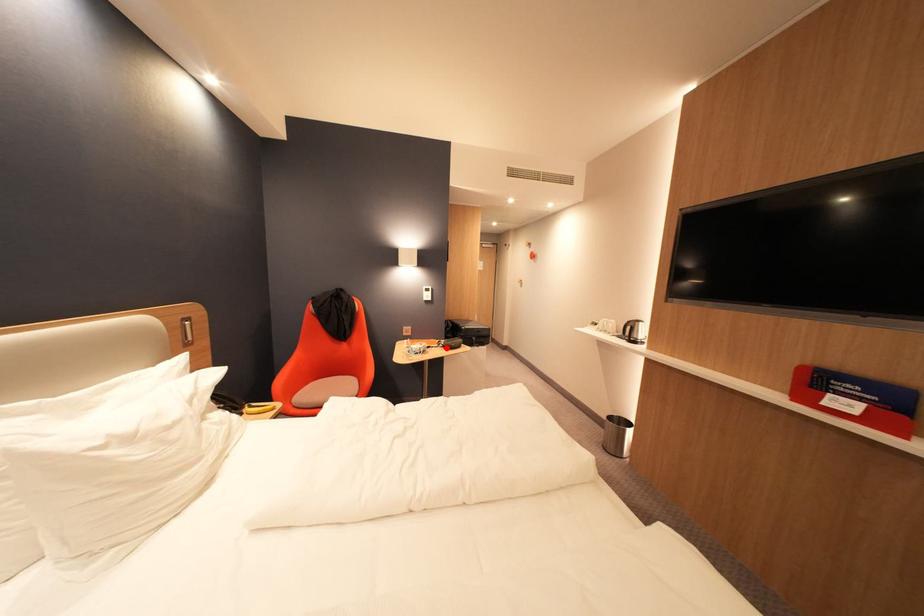
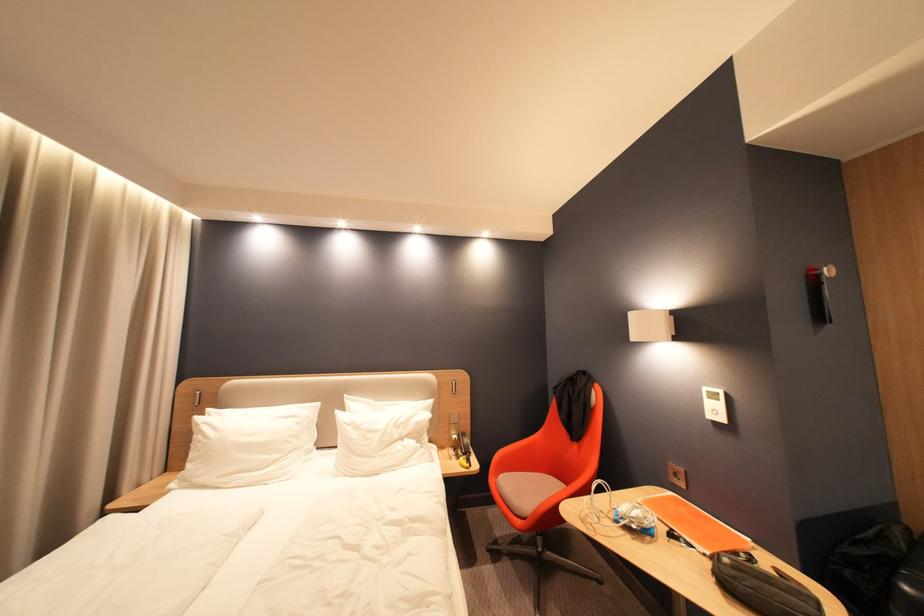
Locate, in the second image, the point that corresponds to the highlighted location in the first image.

(714, 556)